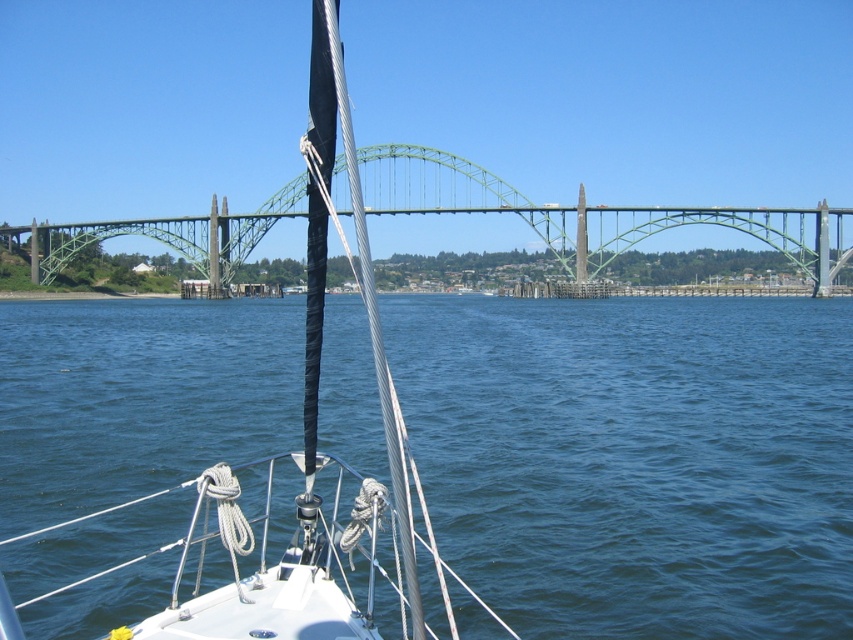
Which is in front, point (160, 499) or point (363, 176)?

Point (160, 499)

Is blue water at center to the left of green metallic bridge at center from the viewer's perspective?

Incorrect, blue water at center is not on the left side of green metallic bridge at center.

Locate an element on the screen. The width and height of the screenshot is (853, 640). blue water at center is located at coordinates pyautogui.click(x=636, y=460).

Is white matte sailboat at center positioned at the back of green metallic bridge at center?

No, white matte sailboat at center is closer to the viewer.

What do you see at coordinates (316, 452) in the screenshot?
I see `white matte sailboat at center` at bounding box center [316, 452].

Does point (405, 554) lie in front of point (393, 208)?

That is True.

Where is `white matte sailboat at center`? Image resolution: width=853 pixels, height=640 pixels. white matte sailboat at center is located at coordinates (316, 452).

Between blue water at center and white matte sailboat at center, which one has less height?

Standing shorter between the two is blue water at center.

Which is in front, point (699, 524) or point (332, 458)?

Point (332, 458)

Locate an element on the screen. The image size is (853, 640). blue water at center is located at coordinates (636, 460).